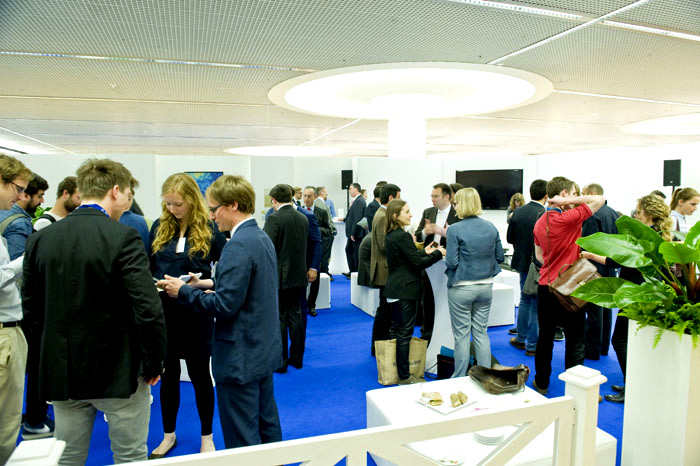
Find the location of a particular element. monitor is located at coordinates (494, 185).